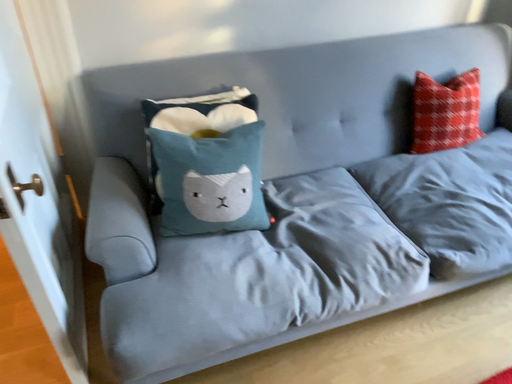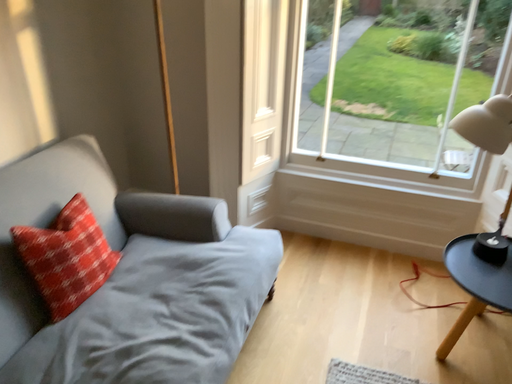
Question: How did the camera likely rotate when shooting the video?

Choices:
 (A) rotated left
 (B) rotated right

Answer: (B)